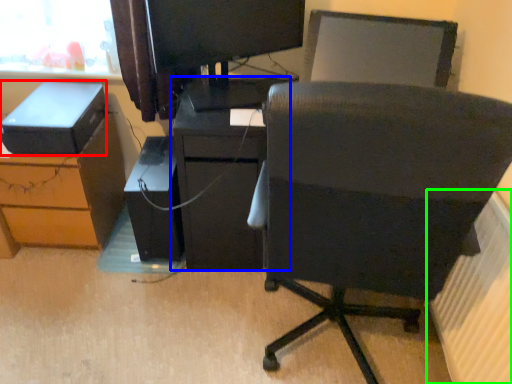
Question: Based on their relative distances, which object is farther from storage box (highlighted by a red box)? Choose from furniture (highlighted by a blue box) and radiator (highlighted by a green box).

Choices:
 (A) furniture
 (B) radiator

Answer: (B)